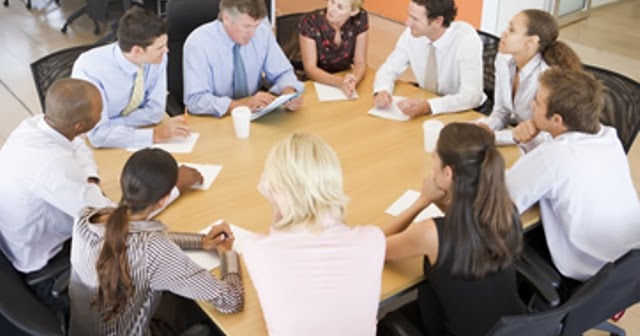
Image resolution: width=640 pixels, height=336 pixels. I want to click on chairs, so click(543, 321), click(620, 280), click(621, 97), click(489, 40), click(289, 21), click(180, 10), click(44, 73), click(35, 312).